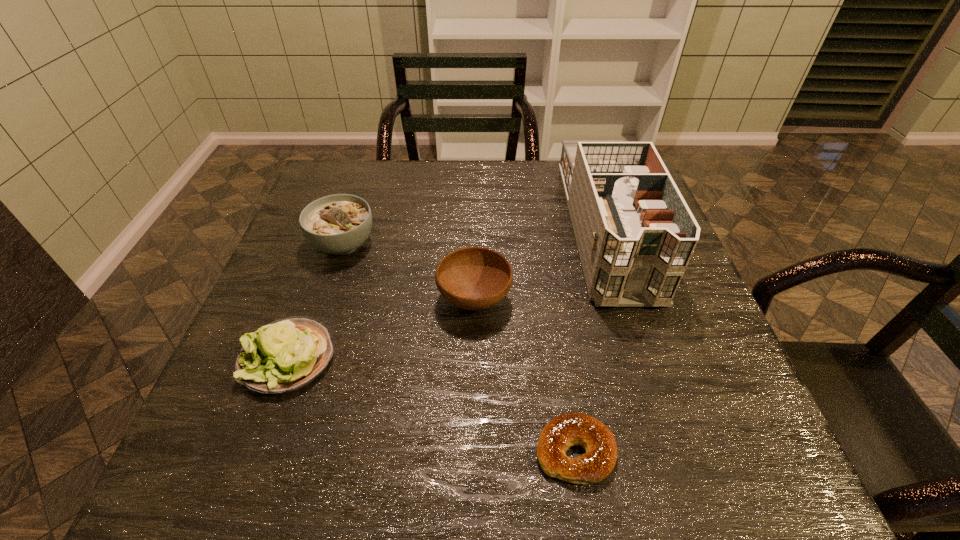
This screenshot has height=540, width=960. Identify the location of free space at the left edge of the desktop. (285, 312).

This screenshot has width=960, height=540. In the image, there is a desktop. Find the location of `vacant space at the right edge`. vacant space at the right edge is located at coordinates (687, 372).

The image size is (960, 540). I want to click on free location at the near left corner of the desktop, so click(245, 469).

Locate an element on the screen. free space at the near right corner of the desktop is located at coordinates (747, 481).

The width and height of the screenshot is (960, 540). I want to click on vacant area that lies between the fourth object from left to right and the second shortest object, so click(x=432, y=404).

At what (x,y) coordinates should I click in order to perform the action: click on free space between the nearest object and the second shortest object. Please return your answer as a coordinate pair (x, y). The width and height of the screenshot is (960, 540). Looking at the image, I should click on (432, 404).

Locate an element on the screen. vacant region between the bagel and the lettuce is located at coordinates (432, 404).

The height and width of the screenshot is (540, 960). I want to click on free space between the lettuce and the soup bowl, so click(316, 300).

Where is `vacant area that lies between the soup bowl and the bowl`? The width and height of the screenshot is (960, 540). vacant area that lies between the soup bowl and the bowl is located at coordinates (409, 272).

I want to click on unoccupied area between the rightmost object and the soup bowl, so click(x=474, y=236).